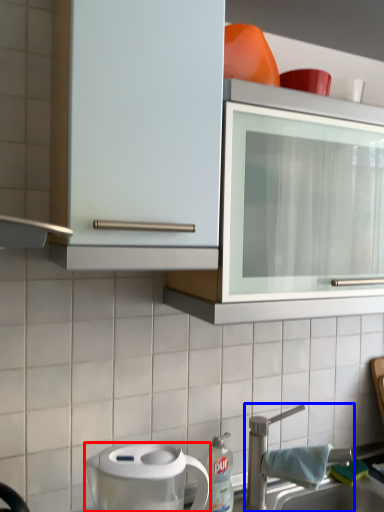
Question: Which of the following is the farthest to the observer, home appliance (highlighted by a red box) or tap (highlighted by a blue box)?

Choices:
 (A) home appliance
 (B) tap

Answer: (B)